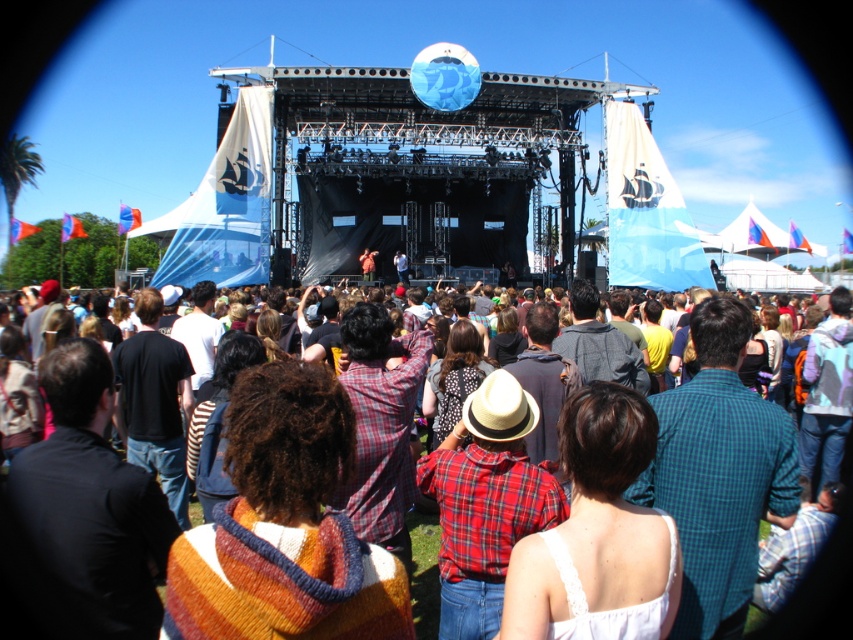
The width and height of the screenshot is (853, 640). What do you see at coordinates (32, 589) in the screenshot?
I see `plaid shirt at center` at bounding box center [32, 589].

Which is behind, point (816, 13) or point (503, 412)?

The point (816, 13) is behind.

The height and width of the screenshot is (640, 853). I want to click on plaid shirt at center, so click(x=32, y=589).